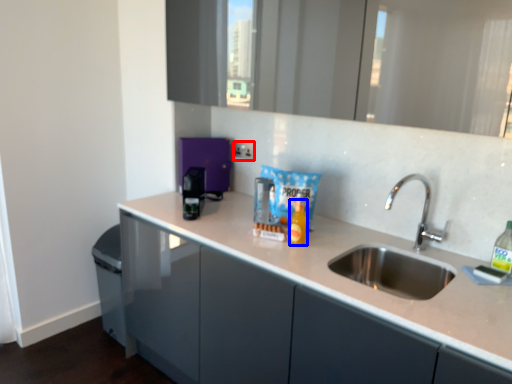
Question: Which of the following is the farthest to the observer, electric outlet (highlighted by a red box) or bottle (highlighted by a blue box)?

Choices:
 (A) electric outlet
 (B) bottle

Answer: (A)